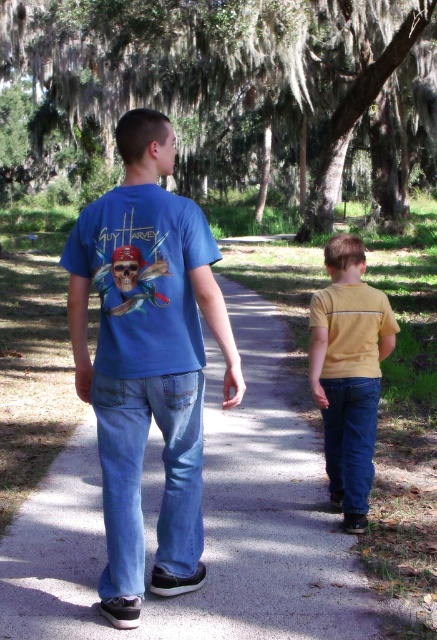
Can you confirm if blue cotton t-shirt at center is positioned above denim at right?

Indeed, blue cotton t-shirt at center is positioned over denim at right.

Is point (187, 586) positioned after point (356, 404)?

No, it is not.

This screenshot has height=640, width=437. What do you see at coordinates (146, 358) in the screenshot? I see `blue cotton t-shirt at center` at bounding box center [146, 358].

Locate an element on the screen. The width and height of the screenshot is (437, 640). blue cotton t-shirt at center is located at coordinates (146, 358).

Between smooth concrete path at center and blue cotton t-shirt at center, which one is positioned higher?

blue cotton t-shirt at center

Is smooth concrete path at center smaller than blue cotton t-shirt at center?

No, smooth concrete path at center is not smaller than blue cotton t-shirt at center.

The height and width of the screenshot is (640, 437). What do you see at coordinates (207, 522) in the screenshot?
I see `smooth concrete path at center` at bounding box center [207, 522].

The width and height of the screenshot is (437, 640). Identify the location of smooth concrete path at center. (207, 522).

Between yellow matte shirt at lower right and denim at right, which one has more height?

With more height is yellow matte shirt at lower right.

Based on the photo, does yellow matte shirt at lower right appear over denim at right?

Correct, yellow matte shirt at lower right is located above denim at right.

What do you see at coordinates (349, 372) in the screenshot? I see `yellow matte shirt at lower right` at bounding box center [349, 372].

Find the location of a particular element. This screenshot has height=640, width=437. yellow matte shirt at lower right is located at coordinates (349, 372).